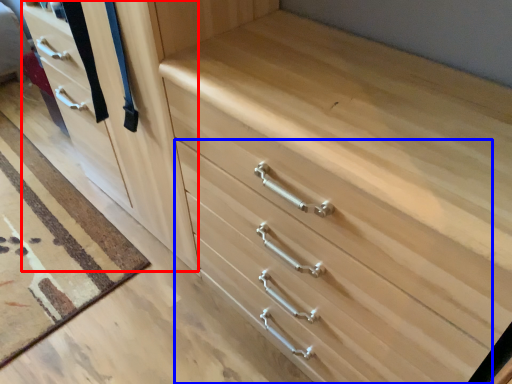
Question: Which of the following is the closest to the observer, door (highlighted by a red box) or drawer (highlighted by a blue box)?

Choices:
 (A) door
 (B) drawer

Answer: (B)